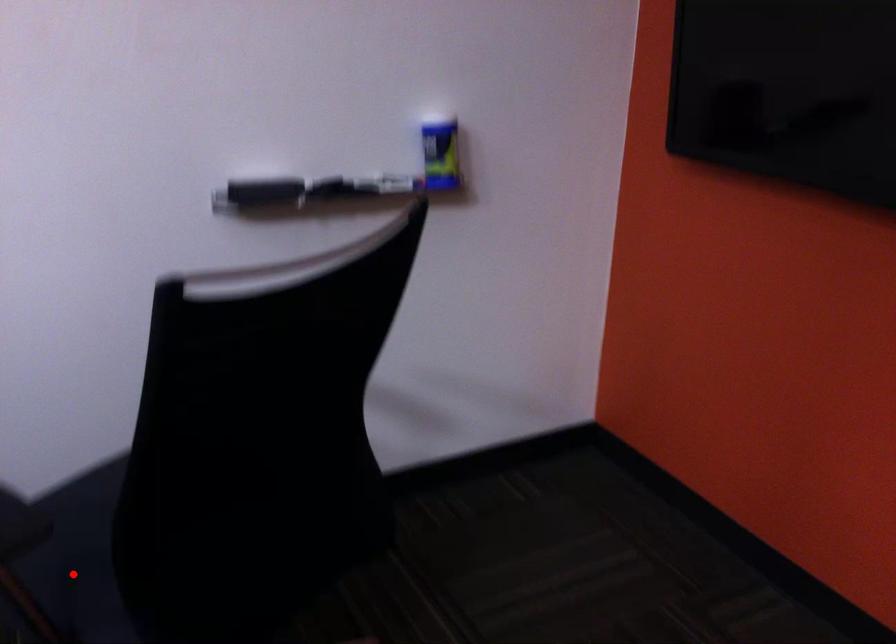
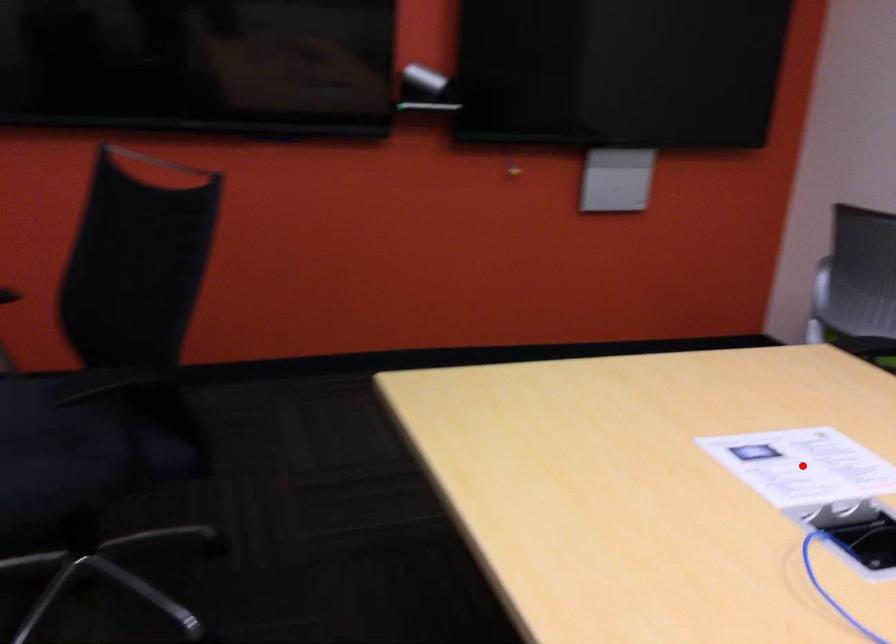
I am providing you with two images of the same scene from different viewpoints. A red point is marked on the first image and another point is marked on the second image. Does the point marked in image1 correspond to the same location as the one in image2?

No